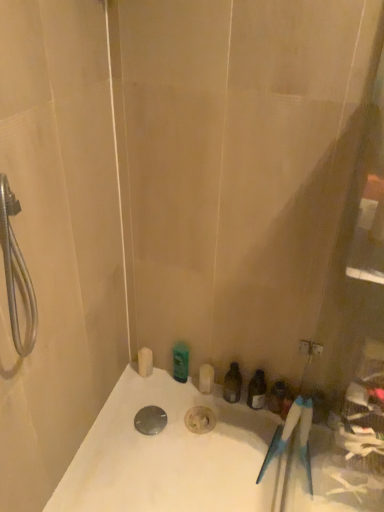
Locate an element on the screen. blank area to the left of translucent plastic bottle at center, which is the second toiletry in right-to-left order is located at coordinates coord(184,405).